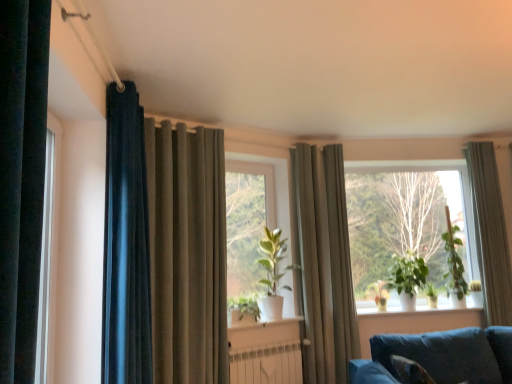
Question: From their relative heights in the image, would you say white matte window sill at center is taller or shorter than matte gray curtain at center, the second curtain positioned from the right?

Choices:
 (A) tall
 (B) short

Answer: (B)

Question: Considering the positions of point (250, 316) and point (337, 286), is point (250, 316) closer or farther from the camera than point (337, 286)?

Choices:
 (A) closer
 (B) farther

Answer: (A)

Question: Considering the real-world distances, which object is closest to the green matte plant at right, the second plant viewed from the right?

Choices:
 (A) green matte plant at center, which is counted as the fourth plant, starting from the right
 (B) green matte plant at right, acting as the 5th plant starting from the left
 (C) matte blue curtain at left, which is counted as the first curtain, starting from the left
 (D) green matte plant at center
 (E) white matte radiator at lower center

Answer: (B)

Question: Which object is positioned closest to the satin beige curtain at left, which is counted as the 3th curtain, starting from the right?

Choices:
 (A) green matte plant at center, the first plant when ordered from left to right
 (B) white matte window sill at center
 (C) green matte plant at center, arranged as the 3th plant when viewed from the right
 (D) green matte plant at center, the 2th window viewed from the right
 (E) green matte plant at right, the second plant viewed from the right

Answer: (A)